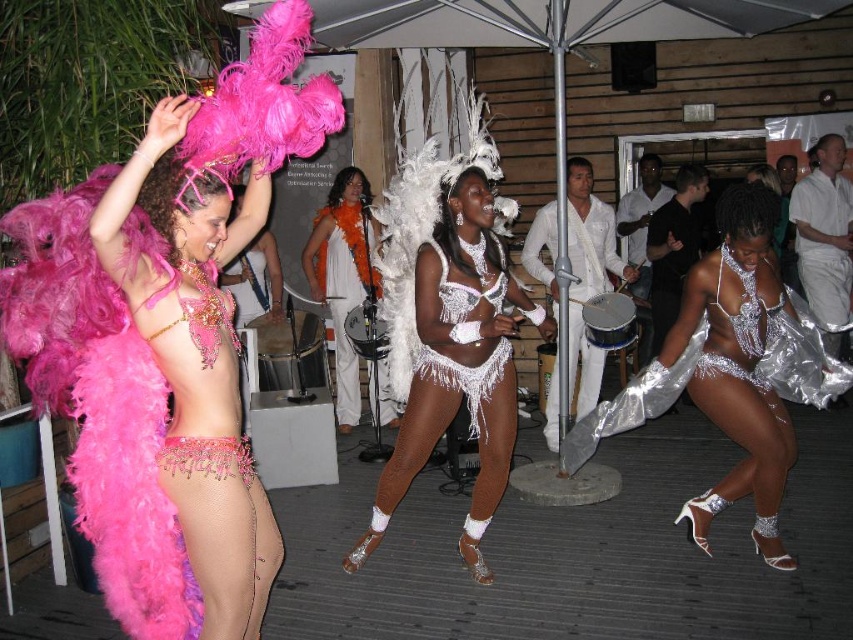
You are a photographer at the dance event and want to capture a closeup shot of both the white fringed bikini at center and the white sequined bikini at center in the same frame. Given that your camera has a maximum focus range of 4 inches, will you be able to capture both in focus?

The distance between the white fringed bikini at center and the white sequined bikini at center is 4.07 inches, which is slightly beyond the camera maximum focus range of 4 inches. Therefore, you won not be able to capture both in focus.